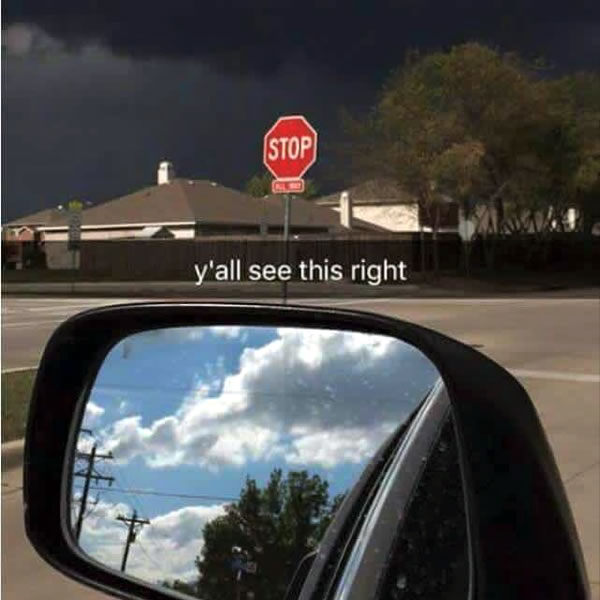
This screenshot has height=600, width=600. I want to click on chimneys, so click(166, 174), click(344, 206).